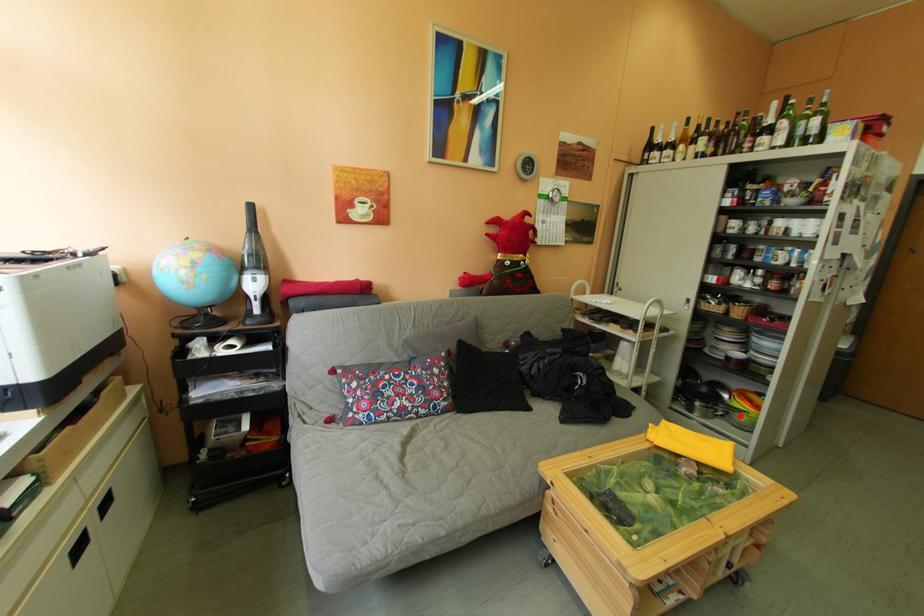
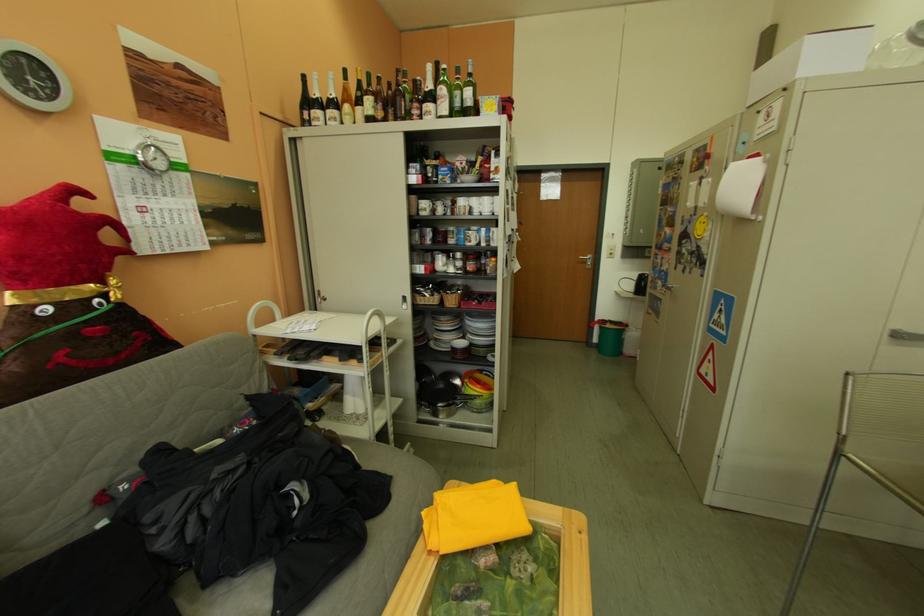
Question: I am providing you with two images of the same scene from different viewpoints. Given a red point in image1, look at the same physical point in image2. Is it:

Choices:
 (A) Closer to the viewpoint
 (B) Farther from the viewpoint

Answer: (B)